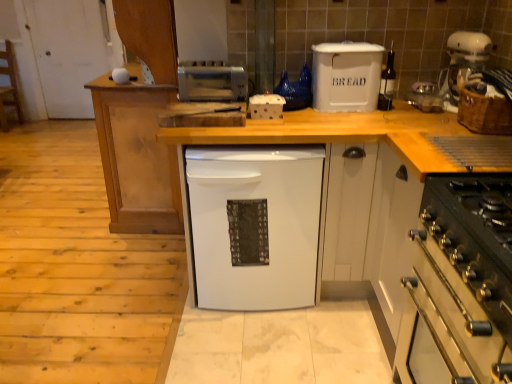
What are the coordinates of `free space to the left of clear plastic container at upper right, the 4th appliance viewed from the left` in the screenshot? It's located at (395, 111).